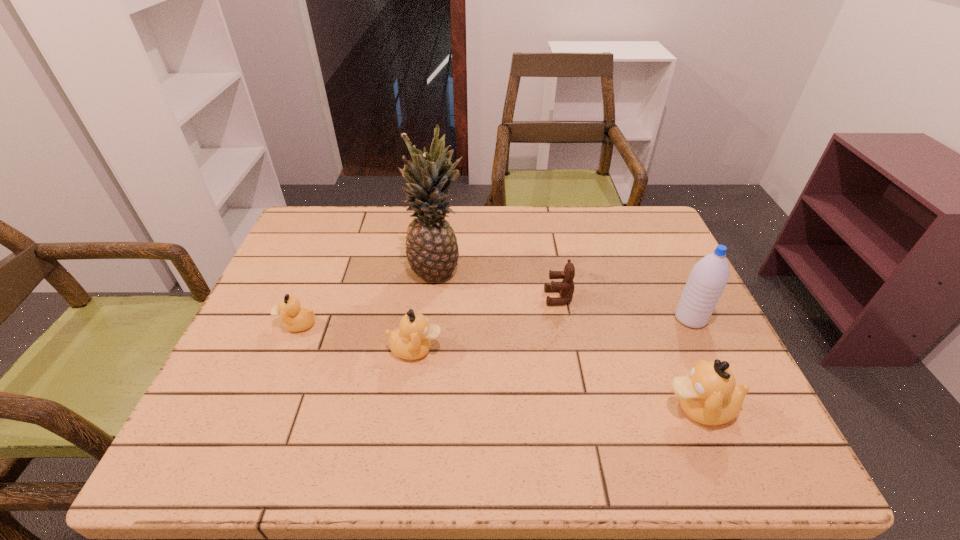
At what (x,y) coordinates should I click in order to perform the action: click on unoccupied position between the fourth shortest object and the leftmost object. Please return your answer as a coordinate pair (x, y). This screenshot has width=960, height=540. Looking at the image, I should click on (498, 366).

The width and height of the screenshot is (960, 540). I want to click on free area in between the fifth shortest object and the second tallest duckling, so click(553, 334).

This screenshot has height=540, width=960. I want to click on empty location between the shortest duckling and the water bottle, so click(x=493, y=321).

The image size is (960, 540). I want to click on free space between the second tallest duckling and the nearest object, so click(x=558, y=379).

This screenshot has width=960, height=540. Identify the location of free space between the second tallest object and the second tallest duckling. (553, 334).

At what (x,y) coordinates should I click in order to perform the action: click on free space between the fourth object from left to right and the tallest object. Please return your answer as a coordinate pair (x, y). The width and height of the screenshot is (960, 540). Looking at the image, I should click on (498, 284).

Where is `empty space that is in between the water bottle and the second shortest duckling`? This screenshot has height=540, width=960. empty space that is in between the water bottle and the second shortest duckling is located at coordinates (553, 334).

At what (x,y) coordinates should I click in order to perform the action: click on object identified as the second closest to the teddy bear. Please return your answer as a coordinate pair (x, y). This screenshot has width=960, height=540. Looking at the image, I should click on (708, 278).

You are a GUI agent. You are given a task and a screenshot of the screen. Output one action in this format:
    pyautogui.click(x=<x>, y=<y>)
    Task: Click on the object that is the third closest to the nearest object
    
    Given the screenshot: What is the action you would take?
    411,341

Select which duckling appears as the second closest to the second duckling from right to left. Please provide its 2D coordinates. Your answer should be formatted as a tuple, i.e. [(x, y)], where the tuple contains the x and y coordinates of a point satisfying the conditions above.

[(709, 395)]